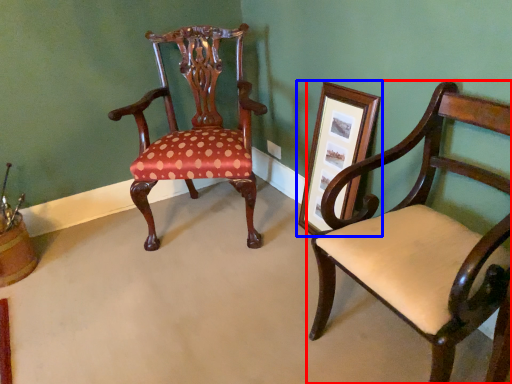
Question: Which point is closer to the camera, chair (highlighted by a red box) or picture frame (highlighted by a blue box)?

Choices:
 (A) chair
 (B) picture frame

Answer: (A)